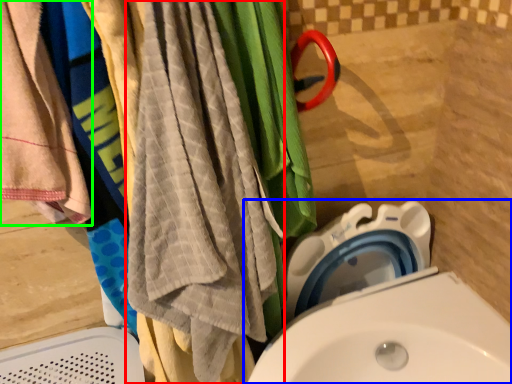
Question: Which is farther away from beach towel (highlighted by a red box)? toilet (highlighted by a blue box) or towel (highlighted by a green box)?

Choices:
 (A) toilet
 (B) towel

Answer: (A)